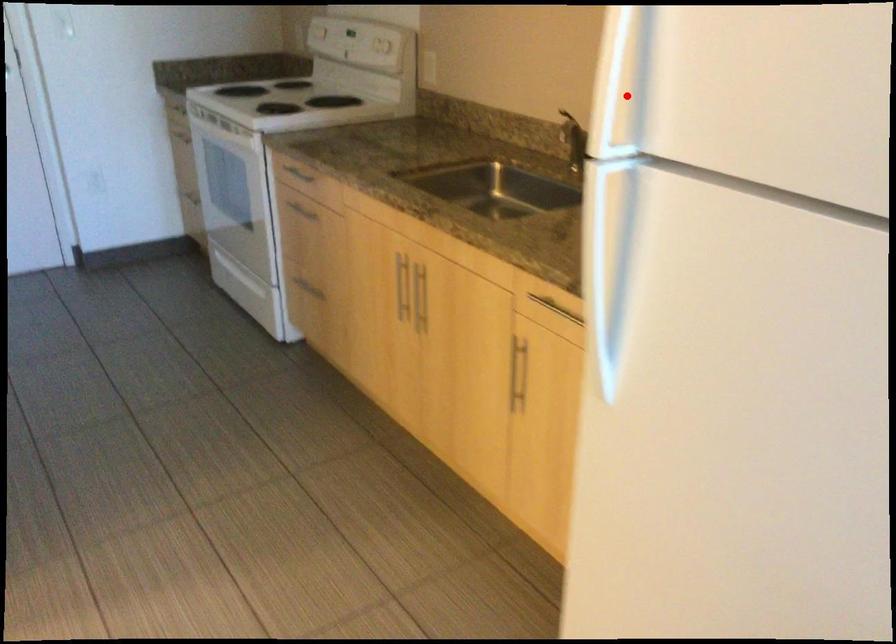
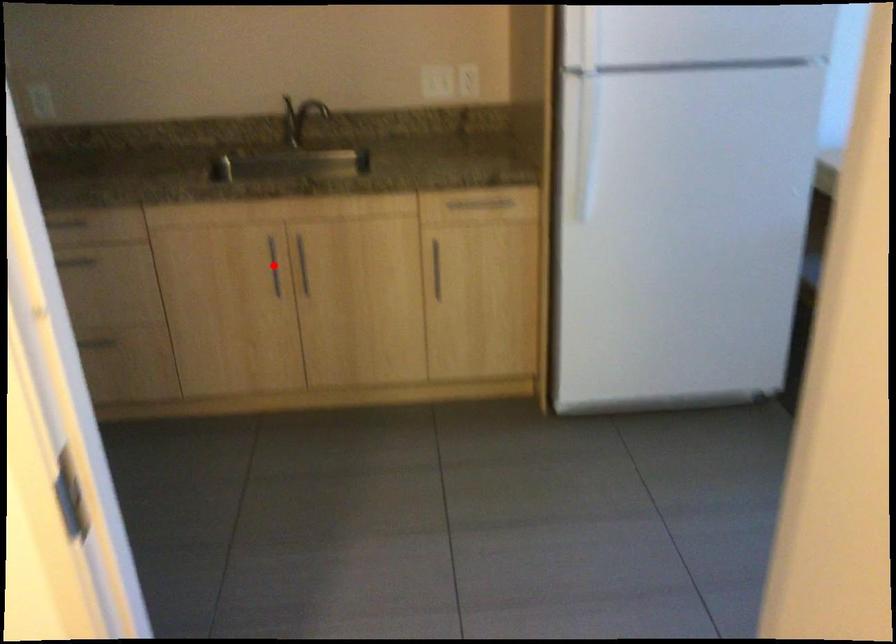
I am providing you with two images of the same scene from different viewpoints. A red point is marked on the first image and another point is marked on the second image. Does the point marked in image1 correspond to the same location as the one in image2?

No